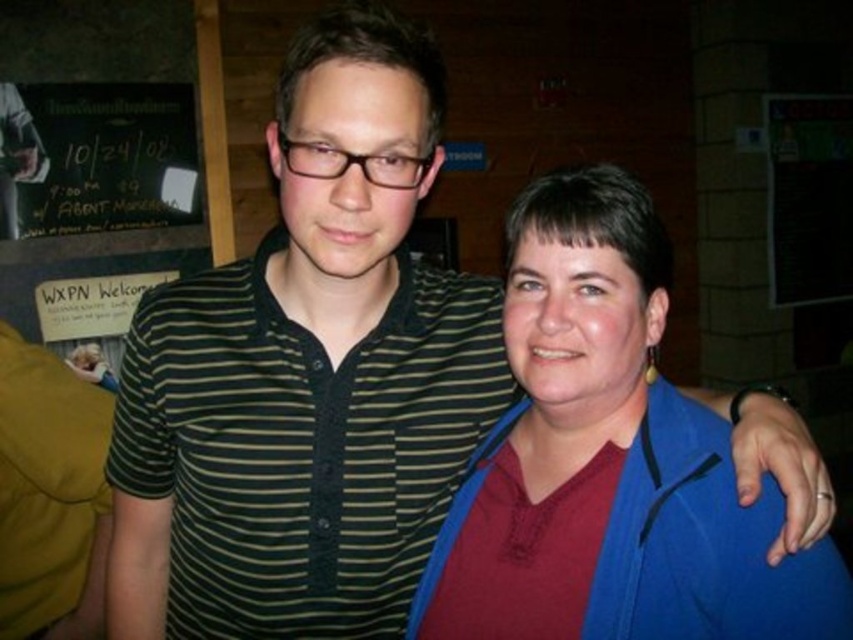
You are an interior designer assessing the layout of this room. You notice the maroon fabric shirt at center and the black chalkboard at upper left. Which object is located to the right of the other?

The maroon fabric shirt at center is positioned on the right side of black chalkboard at upper left.

You are standing in the room and want to reach both the point at coordinates (x=776, y=512) and the point at coordinates (x=219, y=134). Which point will you reach first if you move straight ahead?

You will reach the point at coordinates (x=776, y=512) first because it is closer to you than the point at coordinates (x=219, y=134).

You are a photographer setting up for a group photo. You need to ensure that the maroon fabric shirt at center is visible above the black chalkboard at upper left. Based on the scene description, can you confirm if this is currently achievable?

The maroon fabric shirt at center is positioned under the black chalkboard at upper left, so it is currently not visible above the chalkboard. Adjust the setup to raise the shirt or lower the chalkboard to achieve the desired visibility.